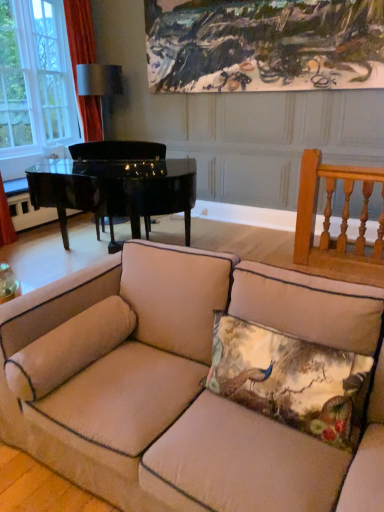
The height and width of the screenshot is (512, 384). What do you see at coordinates (83, 63) in the screenshot? I see `orange fabric curtain at upper left` at bounding box center [83, 63].

The image size is (384, 512). In order to click on beige fabric couch at center in this screenshot , I will do `click(175, 382)`.

Consider the image. In order to face beige fabric couch at center, should I rotate leftwards or rightwards?

To face it directly, rotate right by 0.255 degrees.

Consider the image. Measure the distance between clear glass window at upper left and camera.

The distance of clear glass window at upper left from camera is 16.97 feet.

Describe the element at coordinates (35, 77) in the screenshot. I see `clear glass window at upper left` at that location.

The width and height of the screenshot is (384, 512). I want to click on silky floral pillow at center, placed as the first pillow when sorted from right to left, so click(x=290, y=380).

You are a GUI agent. You are given a task and a screenshot of the screen. Output one action in this format:
    pyautogui.click(x=<x>, y=<y>)
    Task: Click on the white fabric lampshade at upper center
    
    Given the screenshot: What is the action you would take?
    pyautogui.click(x=99, y=80)

This screenshot has height=512, width=384. I want to click on beige fabric pillow at lower left, which ranks as the second pillow in right-to-left order, so click(x=69, y=348).

From the image's perspective, between orange fabric curtain at upper left and black polished piano at left, who is located below?

black polished piano at left, from the image's perspective.

How distant is orange fabric curtain at upper left from black polished piano at left?

1.96 meters.

From a real-world perspective, who is located lower, orange fabric curtain at upper left or black polished piano at left?

black polished piano at left.

Is the position of orange fabric curtain at upper left less distant than that of black polished piano at left?

No, it is behind black polished piano at left.

Does silky floral pillow at center, placed as the first pillow when sorted from right to left, have a lesser height compared to white fabric lampshade at upper center?

Yes, silky floral pillow at center, placed as the first pillow when sorted from right to left, is shorter than white fabric lampshade at upper center.

From the picture: How different are the orientations of silky floral pillow at center, placed as the first pillow when sorted from right to left, and white fabric lampshade at upper center in degrees?

The angular difference between silky floral pillow at center, placed as the first pillow when sorted from right to left, and white fabric lampshade at upper center is 0.166 degrees.

Between silky floral pillow at center, placed as the first pillow when sorted from right to left, and white fabric lampshade at upper center, which one has smaller size?

With smaller size is silky floral pillow at center, placed as the first pillow when sorted from right to left.

From the image's perspective, is silky floral pillow at center, placed as the first pillow when sorted from right to left, on white fabric lampshade at upper center?

Actually, silky floral pillow at center, placed as the first pillow when sorted from right to left, appears below white fabric lampshade at upper center in the image.

Is white fabric lampshade at upper center touching beige fabric couch at center?

No, white fabric lampshade at upper center is not beside beige fabric couch at center.

From the image's perspective, is white fabric lampshade at upper center above or below beige fabric couch at center?

From the image's perspective, white fabric lampshade at upper center appears above beige fabric couch at center.

Is white fabric lampshade at upper center positioned beyond the bounds of beige fabric couch at center?

That's correct, white fabric lampshade at upper center is outside of beige fabric couch at center.

Locate an element on the screen. The image size is (384, 512). curtain on the left of black polished piano at left is located at coordinates (83, 63).

Is black polished piano at left to the left of orange fabric curtain at upper left from the viewer's perspective?

No, black polished piano at left is not to the left of orange fabric curtain at upper left.

From the image's perspective, is black polished piano at left above or below orange fabric curtain at upper left?

Clearly, from the image's perspective, black polished piano at left is below orange fabric curtain at upper left.

Which of these two, beige fabric pillow at lower left, which ranks as the second pillow in right-to-left order, or silky floral pillow at center, positioned as the second pillow in left-to-right order, stands taller?

With more height is beige fabric pillow at lower left, which ranks as the second pillow in right-to-left order.

Looking at this image, is the depth of beige fabric pillow at lower left, which ranks as the first pillow in left-to-right order, less than that of silky floral pillow at center, placed as the first pillow when sorted from right to left?

No, beige fabric pillow at lower left, which ranks as the first pillow in left-to-right order, is further to the viewer.

Could you tell me if beige fabric pillow at lower left, which ranks as the second pillow in right-to-left order, is facing silky floral pillow at center, placed as the first pillow when sorted from right to left?

Yes.

Between beige fabric pillow at lower left, which ranks as the second pillow in right-to-left order, and silky floral pillow at center, placed as the first pillow when sorted from right to left, which one has larger size?

silky floral pillow at center, placed as the first pillow when sorted from right to left.

Considering the sizes of objects white fabric lampshade at upper center and beige fabric pillow at lower left, which ranks as the first pillow in left-to-right order, in the image provided, who is thinner, white fabric lampshade at upper center or beige fabric pillow at lower left, which ranks as the first pillow in left-to-right order,?

With smaller width is beige fabric pillow at lower left, which ranks as the first pillow in left-to-right order.

Would you say white fabric lampshade at upper center is outside beige fabric pillow at lower left, which ranks as the second pillow in right-to-left order?

white fabric lampshade at upper center is positioned outside beige fabric pillow at lower left, which ranks as the second pillow in right-to-left order.

Does point (113, 92) come in front of point (96, 356)?

That is False.

How many degrees apart are the facing directions of white fabric lampshade at upper center and beige fabric pillow at lower left, which ranks as the first pillow in left-to-right order?

They differ by 89.8 degrees in their facing directions.

In the scene shown: Does silky floral pillow at center, positioned as the second pillow in left-to-right order, appear on the right side of beige fabric couch at center?

Indeed, silky floral pillow at center, positioned as the second pillow in left-to-right order, is positioned on the right side of beige fabric couch at center.

Is the surface of silky floral pillow at center, positioned as the second pillow in left-to-right order, in direct contact with beige fabric couch at center?

No, silky floral pillow at center, positioned as the second pillow in left-to-right order, is not with beige fabric couch at center.

Is silky floral pillow at center, placed as the first pillow when sorted from right to left, oriented towards beige fabric couch at center?

Yes, silky floral pillow at center, placed as the first pillow when sorted from right to left, is turned towards beige fabric couch at center.

From the image's perspective, is silky floral pillow at center, positioned as the second pillow in left-to-right order, on beige fabric couch at center?

Indeed, from the image's perspective, silky floral pillow at center, positioned as the second pillow in left-to-right order, is shown above beige fabric couch at center.

You are a GUI agent. You are given a task and a screenshot of the screen. Output one action in this format:
    pyautogui.click(x=<x>, y=<y>)
    Task: Click on the curtain positioned vertically above the black polished piano at left (from a real-world perspective)
    This screenshot has width=384, height=512.
    Given the screenshot: What is the action you would take?
    pyautogui.click(x=83, y=63)

Locate an element on the screen. lamp located behind the silky floral pillow at center, placed as the first pillow when sorted from right to left is located at coordinates (99, 80).

Looking at the image, which one is located further to white fabric lampshade at upper center, beige fabric pillow at lower left, which ranks as the first pillow in left-to-right order, or black polished piano at left?

beige fabric pillow at lower left, which ranks as the first pillow in left-to-right order, lies further to white fabric lampshade at upper center than the other object.

Looking at the image, which one is located closer to clear glass window at upper left, black polished piano at left or beige fabric pillow at lower left, which ranks as the second pillow in right-to-left order?

The object closer to clear glass window at upper left is black polished piano at left.

From the image, which object appears to be nearer to beige fabric couch at center, beige fabric pillow at lower left, which ranks as the second pillow in right-to-left order, or clear glass window at upper left?

Among the two, beige fabric pillow at lower left, which ranks as the second pillow in right-to-left order, is located nearer to beige fabric couch at center.

Looking at the image, which one is located closer to beige fabric couch at center, beige fabric pillow at lower left, which ranks as the second pillow in right-to-left order, or black polished piano at left?

Based on the image, beige fabric pillow at lower left, which ranks as the second pillow in right-to-left order, appears to be nearer to beige fabric couch at center.

Consider the image. Estimate the real-world distances between objects in this image. Which object is closer to black polished piano at left, beige fabric couch at center or silky floral pillow at center, positioned as the second pillow in left-to-right order?

beige fabric couch at center is positioned closer to the anchor black polished piano at left.

When comparing their distances from clear glass window at upper left, does black polished piano at left or silky floral pillow at center, positioned as the second pillow in left-to-right order, seem closer?

black polished piano at left is closer to clear glass window at upper left.

Based on their spatial positions, is orange fabric curtain at upper left or clear glass window at upper left closer to black polished piano at left?

clear glass window at upper left is closer to black polished piano at left.

From the image, which object appears to be nearer to beige fabric pillow at lower left, which ranks as the second pillow in right-to-left order, orange fabric curtain at upper left or beige fabric couch at center?

beige fabric couch at center is closer to beige fabric pillow at lower left, which ranks as the second pillow in right-to-left order.

You are a GUI agent. You are given a task and a screenshot of the screen. Output one action in this format:
    pyautogui.click(x=<x>, y=<y>)
    Task: Click on the lamp located between silky floral pillow at center, positioned as the second pillow in left-to-right order, and orange fabric curtain at upper left in the depth direction
    The width and height of the screenshot is (384, 512).
    Given the screenshot: What is the action you would take?
    pyautogui.click(x=99, y=80)

The image size is (384, 512). What are the coordinates of `pillow between silky floral pillow at center, placed as the first pillow when sorted from right to left, and orange fabric curtain at upper left in the front-back direction` in the screenshot? It's located at (69, 348).

Find the location of a particular element. pillow between silky floral pillow at center, placed as the first pillow when sorted from right to left, and white fabric lampshade at upper center in the front-back direction is located at coordinates (69, 348).

Find the location of a particular element. This screenshot has width=384, height=512. curtain positioned between silky floral pillow at center, placed as the first pillow when sorted from right to left, and clear glass window at upper left from near to far is located at coordinates (83, 63).